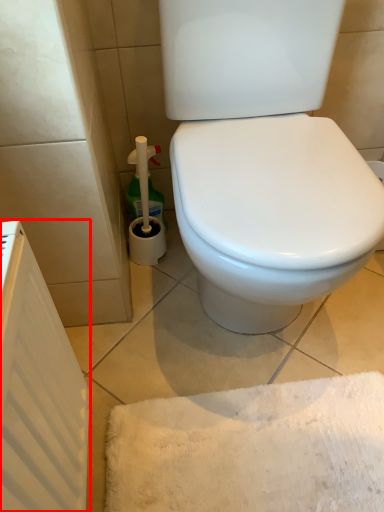
Question: From the image's perspective, what is the correct spatial relationship of radiator (annotated by the red box) in relation to cleaning product?

Choices:
 (A) below
 (B) above

Answer: (A)